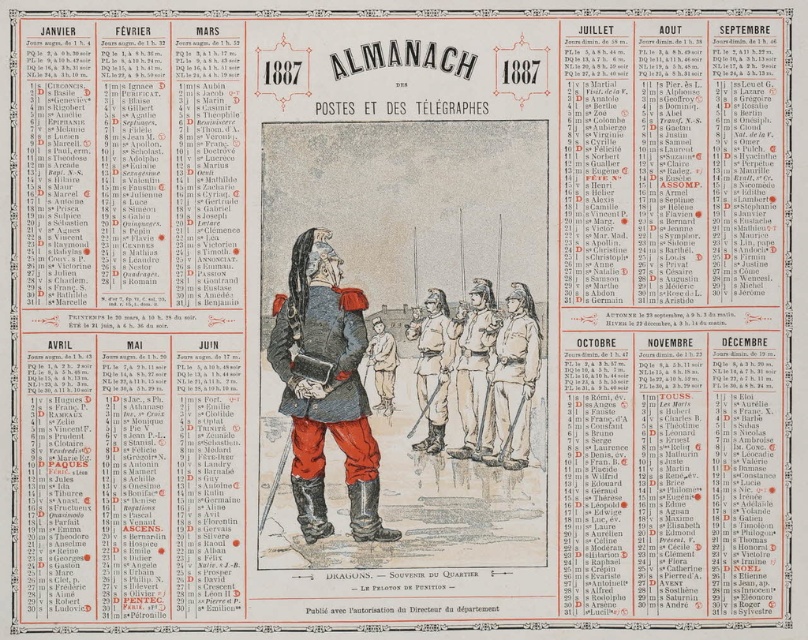
Question: Which point is closer to the camera taking this photo?

Choices:
 (A) (469, 420)
 (B) (436, 394)
 (C) (388, 340)
 (D) (494, 404)

Answer: (B)

Question: Considering the real-world distances, which object is closest to the smooth blue coat at center?

Choices:
 (A) brown paper uniform at center
 (B) light brown leather uniform at center

Answer: (A)

Question: Does smooth blue coat at center appear on the left side of brown paper uniform at center?

Choices:
 (A) yes
 (B) no

Answer: (A)

Question: Is light brown leather uniform at center bigger than brown paper uniform at center?

Choices:
 (A) yes
 (B) no

Answer: (A)

Question: Which object is farther from the camera taking this photo?

Choices:
 (A) brown paper uniform at center
 (B) light brown leather boots at center
 (C) light brown leather uniform at center

Answer: (C)

Question: Can you confirm if light brown leather uniform at center is positioned to the right of brown leather boots at center?

Choices:
 (A) no
 (B) yes

Answer: (B)